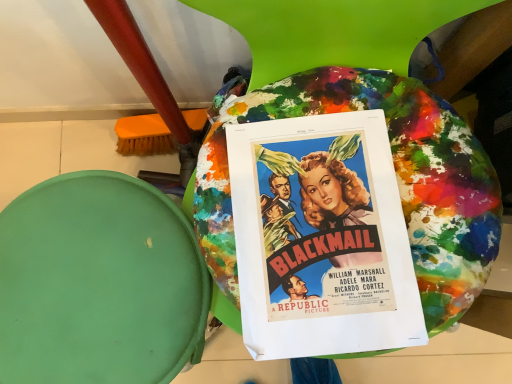
Question: Is paint splattered fabric bean bag at center further to the viewer compared to vibrant paper poster at center?

Choices:
 (A) no
 (B) yes

Answer: (B)

Question: Is paint splattered fabric bean bag at center wider than vibrant paper poster at center?

Choices:
 (A) no
 (B) yes

Answer: (B)

Question: Is vibrant paper poster at center a part of paint splattered fabric bean bag at center?

Choices:
 (A) no
 (B) yes

Answer: (A)

Question: From the image's perspective, is paint splattered fabric bean bag at center under vibrant paper poster at center?

Choices:
 (A) yes
 (B) no

Answer: (A)

Question: From the image's perspective, would you say paint splattered fabric bean bag at center is positioned over vibrant paper poster at center?

Choices:
 (A) yes
 (B) no

Answer: (B)

Question: Can you confirm if paint splattered fabric bean bag at center is thinner than vibrant paper poster at center?

Choices:
 (A) no
 (B) yes

Answer: (A)

Question: Is vibrant paper poster at center thinner than paint splattered fabric bean bag at center?

Choices:
 (A) no
 (B) yes

Answer: (B)

Question: Is vibrant paper poster at center surrounding paint splattered fabric bean bag at center?

Choices:
 (A) no
 (B) yes

Answer: (A)

Question: From a real-world perspective, is vibrant paper poster at center located beneath paint splattered fabric bean bag at center?

Choices:
 (A) no
 (B) yes

Answer: (A)

Question: From the image's perspective, is vibrant paper poster at center below paint splattered fabric bean bag at center?

Choices:
 (A) yes
 (B) no

Answer: (B)

Question: Is vibrant paper poster at center at the left side of paint splattered fabric bean bag at center?

Choices:
 (A) no
 (B) yes

Answer: (A)

Question: Is vibrant paper poster at center in front of paint splattered fabric bean bag at center?

Choices:
 (A) no
 (B) yes

Answer: (B)

Question: Is vibrant paper poster at center taller or shorter than paint splattered fabric bean bag at center?

Choices:
 (A) short
 (B) tall

Answer: (A)